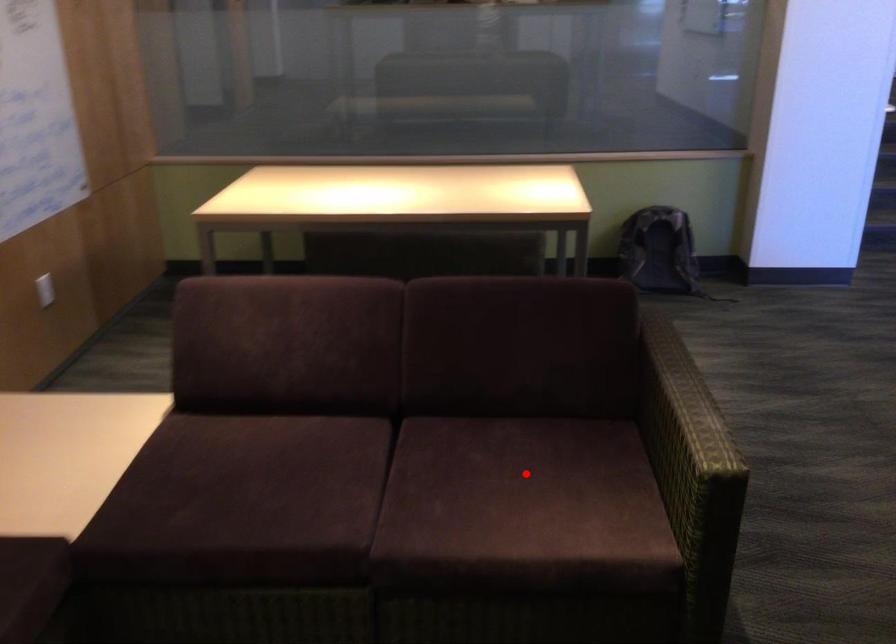
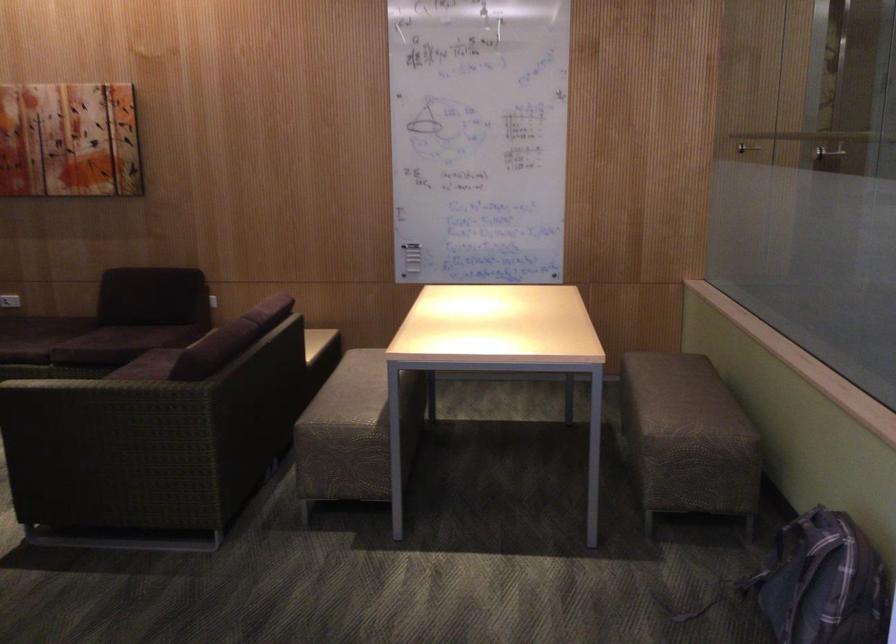
Question: I am providing you with two images of the same scene from different viewpoints. A red point is marked on the first image. Can you still see the location of the red point in image 2?

Choices:
 (A) Yes
 (B) No

Answer: (B)